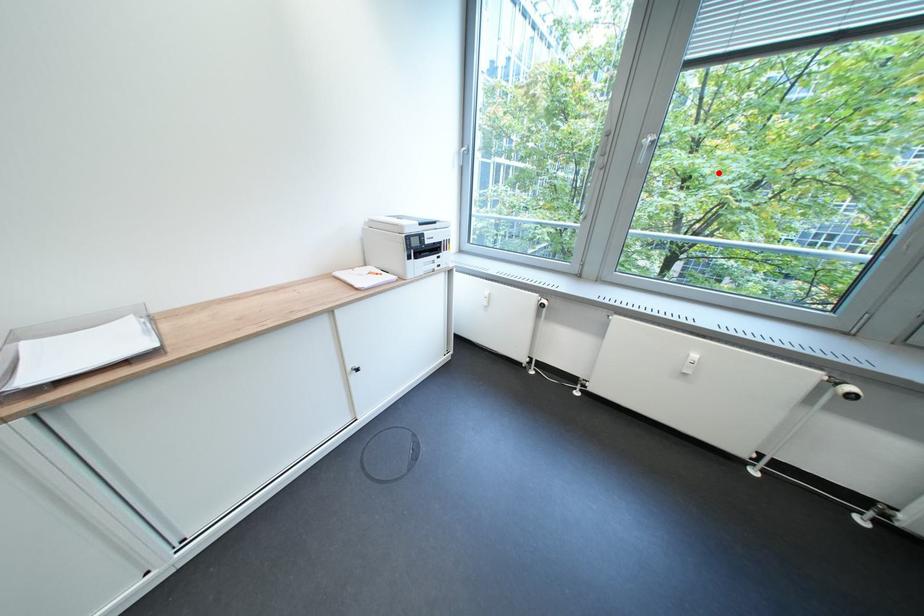
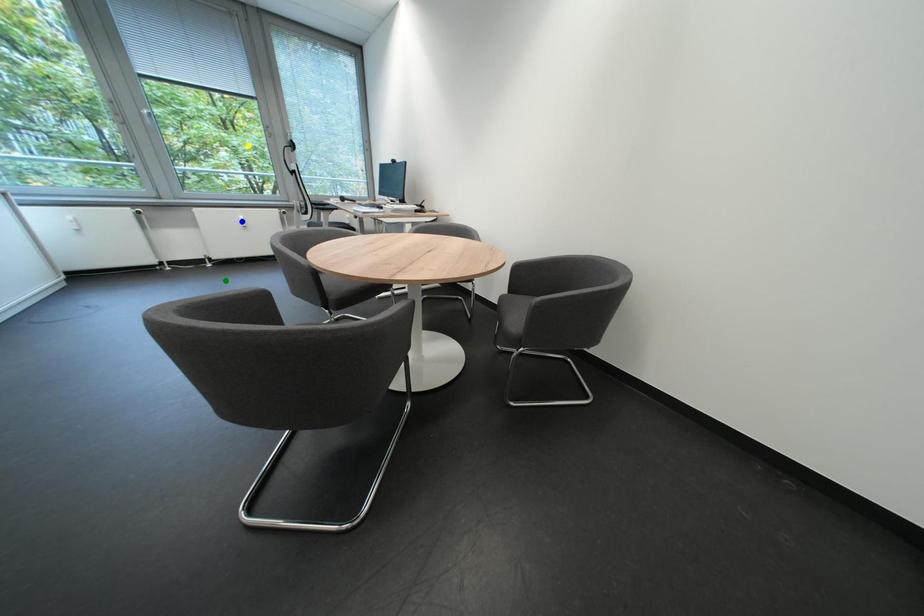
Question: I am providing you with two images of the same scene from different viewpoints. A red point is marked on the first image. You are given multiple points on the second image. Which point in image 2 represents the same 3d spot as the red point in image 1?

Choices:
 (A) yellow point
 (B) green point
 (C) blue point

Answer: (A)